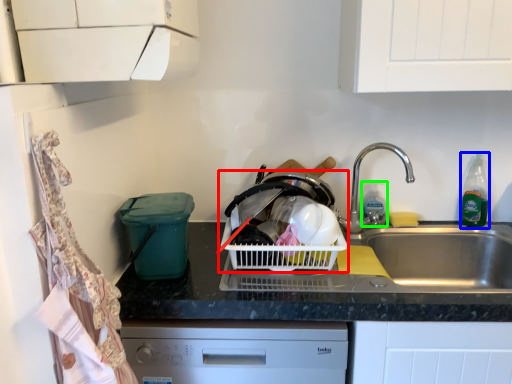
Question: Which is nearer to the basket container (highlighted by a red box)? bottle (highlighted by a blue box) or bottle (highlighted by a green box).

Choices:
 (A) bottle
 (B) bottle

Answer: (B)